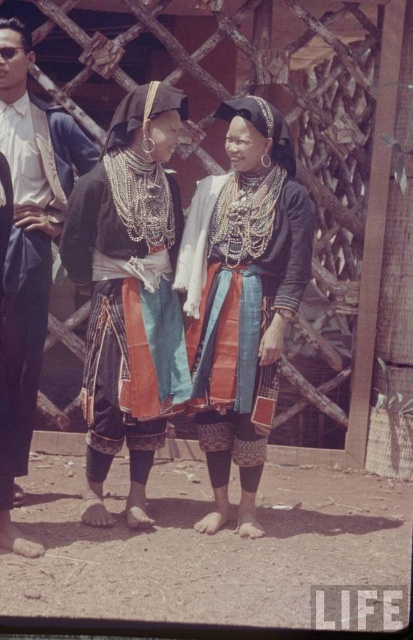
Question: Based on their relative distances, which object is nearer to the matte black dress at center?

Choices:
 (A) textured blue skirt at center
 (B) matte black dress at left

Answer: (A)

Question: Which of these objects is positioned farthest from the matte black dress at left?

Choices:
 (A) textured blue skirt at center
 (B) matte black dress at center

Answer: (A)

Question: Is textured blue skirt at center further to camera compared to matte black dress at left?

Choices:
 (A) no
 (B) yes

Answer: (A)

Question: Does textured blue skirt at center appear under matte black dress at left?

Choices:
 (A) no
 (B) yes

Answer: (A)

Question: Which of the following is the farthest from the observer?

Choices:
 (A) (241, 342)
 (B) (151, 298)
 (C) (14, 397)

Answer: (C)

Question: Is matte black dress at center thinner than textured blue skirt at center?

Choices:
 (A) no
 (B) yes

Answer: (B)